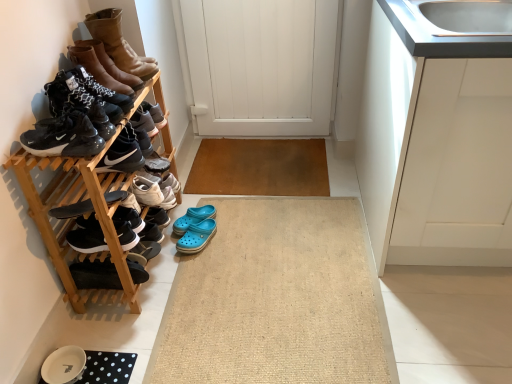
Question: Does black matte sneakers at lower left, which is counted as the 6th footwear, starting from the top, have a greater width compared to beige woven bath mat at center?

Choices:
 (A) yes
 (B) no

Answer: (B)

Question: Does black matte sneakers at lower left, which ranks as the third footwear in bottom-to-top order, appear on the left side of beige woven bath mat at center?

Choices:
 (A) yes
 (B) no

Answer: (A)

Question: Is black matte sneakers at lower left, which ranks as the third footwear in bottom-to-top order, behind beige woven bath mat at center?

Choices:
 (A) yes
 (B) no

Answer: (A)

Question: Is black matte sneakers at lower left, which ranks as the third footwear in bottom-to-top order, shorter than beige woven bath mat at center?

Choices:
 (A) no
 (B) yes

Answer: (A)

Question: From a real-world perspective, does black matte sneakers at lower left, which is counted as the 6th footwear, starting from the top, stand above beige woven bath mat at center?

Choices:
 (A) no
 (B) yes

Answer: (B)

Question: From a real-world perspective, is black suede sneakers at left, the 6th footwear ordered from the bottom, physically located above or below leather boots at upper left, which is counted as the first footwear, starting from the top?

Choices:
 (A) below
 (B) above

Answer: (A)

Question: Is black suede sneakers at left, the 6th footwear ordered from the bottom, spatially inside leather boots at upper left, which is counted as the first footwear, starting from the top, or outside of it?

Choices:
 (A) inside
 (B) outside

Answer: (B)

Question: Is black suede sneakers at left, positioned as the third footwear in top-to-bottom order, to the left or to the right of leather boots at upper left, which ranks as the eighth footwear in bottom-to-top order, in the image?

Choices:
 (A) left
 (B) right

Answer: (A)

Question: In terms of width, does black suede sneakers at left, positioned as the third footwear in top-to-bottom order, look wider or thinner when compared to leather boots at upper left, which ranks as the eighth footwear in bottom-to-top order?

Choices:
 (A) thin
 (B) wide

Answer: (A)

Question: From the image's perspective, is wooden shoe rack at left located above or below black suede sneakers at left, positioned as the third footwear in top-to-bottom order?

Choices:
 (A) above
 (B) below

Answer: (B)

Question: Considering their positions, is wooden shoe rack at left located in front of or behind black suede sneakers at left, the 6th footwear ordered from the bottom?

Choices:
 (A) behind
 (B) front

Answer: (B)

Question: From a real-world perspective, is wooden shoe rack at left positioned above or below black suede sneakers at left, positioned as the third footwear in top-to-bottom order?

Choices:
 (A) above
 (B) below

Answer: (B)

Question: In terms of height, does wooden shoe rack at left look taller or shorter compared to black suede sneakers at left, positioned as the third footwear in top-to-bottom order?

Choices:
 (A) tall
 (B) short

Answer: (A)

Question: Considering their positions, is leather boots at upper left, which is counted as the first footwear, starting from the top, located in front of or behind black suede shoe at lower left, the second shoe viewed from the top?

Choices:
 (A) front
 (B) behind

Answer: (B)

Question: From a real-world perspective, is leather boots at upper left, which ranks as the eighth footwear in bottom-to-top order, positioned above or below black suede shoe at lower left, the second shoe viewed from the top?

Choices:
 (A) above
 (B) below

Answer: (A)